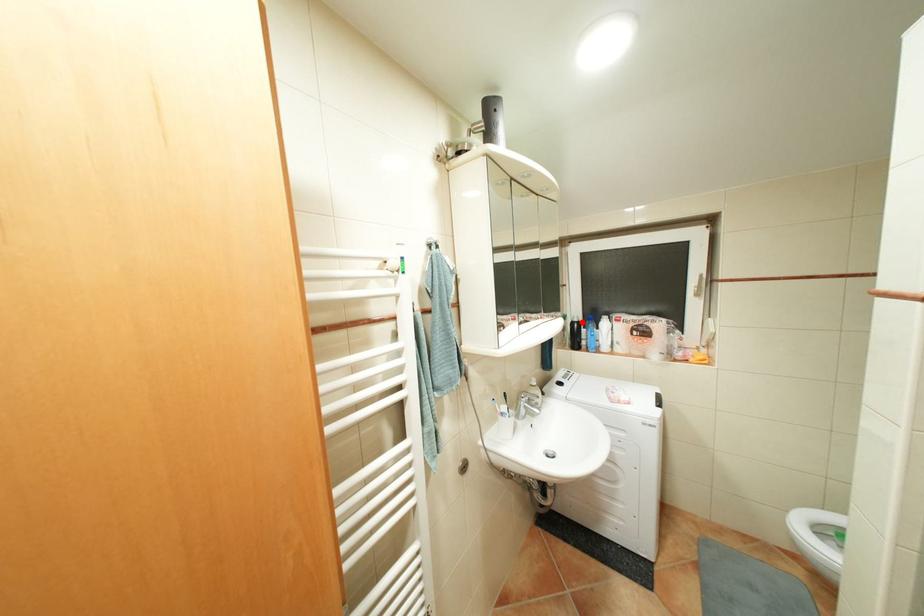
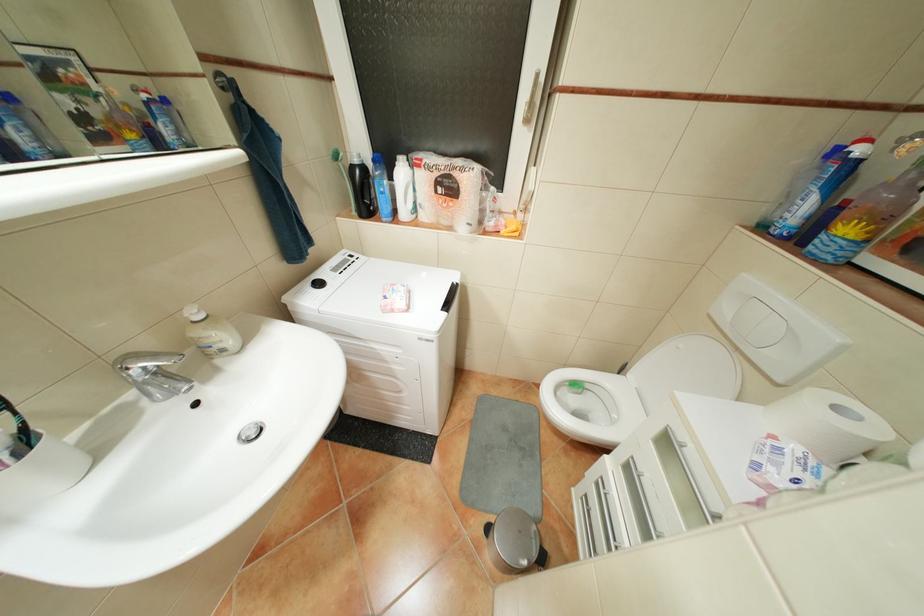
Where in the second image is the point corresponding to the highlighted location from the first image?

(361, 167)